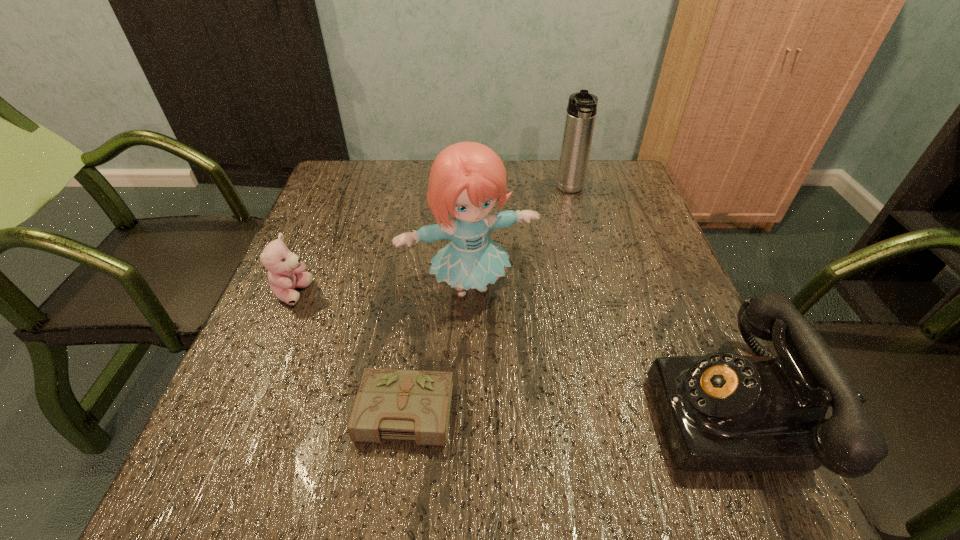
This screenshot has width=960, height=540. I want to click on vacant space located on the dial of the rightmost object, so click(551, 410).

Locate an element on the screen. free space located 0.300m on the dial of the rightmost object is located at coordinates (482, 410).

Where is `vacant region located on the front-facing side of the doll`? vacant region located on the front-facing side of the doll is located at coordinates (510, 359).

Identify the location of vacant area situated on the front-facing side of the doll. This screenshot has height=540, width=960. (539, 424).

You are a GUI agent. You are given a task and a screenshot of the screen. Output one action in this format:
    pyautogui.click(x=<x>, y=<y>)
    Task: Click on the free space located 0.280m on the front-facing side of the doll
    
    Given the screenshot: What is the action you would take?
    pyautogui.click(x=543, y=435)

Find the location of a particular element. vacant region located on the handle side of the fourth object from left to right is located at coordinates (588, 310).

Identify the location of free space located on the handle side of the fourth object from left to right. The image size is (960, 540). (588, 307).

This screenshot has height=540, width=960. Identify the location of free space located 0.070m on the handle side of the fourth object from left to right. (575, 218).

Where is `vacant space located 0.380m at the face of the teddy bear`? The width and height of the screenshot is (960, 540). vacant space located 0.380m at the face of the teddy bear is located at coordinates (453, 379).

Where is `vacant region located at the face of the teddy bear`? This screenshot has height=540, width=960. vacant region located at the face of the teddy bear is located at coordinates (363, 331).